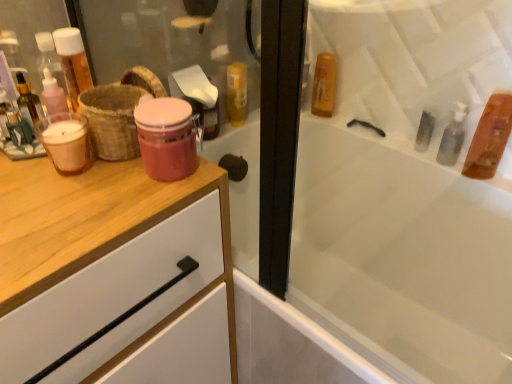
Question: Is translucent glass mouthwash at left, the first mouthwash positioned from the left, facing towards brown woven basket at left?

Choices:
 (A) no
 (B) yes

Answer: (A)

Question: Does translucent glass mouthwash at left, the 2th mouthwash when ordered from front to back, touch brown woven basket at left?

Choices:
 (A) no
 (B) yes

Answer: (B)

Question: From the image's perspective, is translucent glass mouthwash at left, which ranks as the 4th mouthwash in right-to-left order, beneath brown woven basket at left?

Choices:
 (A) yes
 (B) no

Answer: (A)

Question: From a real-world perspective, is translucent glass mouthwash at left, the third mouthwash when ordered from back to front, located beneath brown woven basket at left?

Choices:
 (A) no
 (B) yes

Answer: (B)

Question: Does translucent glass mouthwash at left, the 2th mouthwash when ordered from front to back, have a smaller size compared to brown woven basket at left?

Choices:
 (A) no
 (B) yes

Answer: (B)

Question: From a real-world perspective, is matte pink glass jar at center, acting as the 2th mouthwash starting from the left, above or below brown woven basket at left?

Choices:
 (A) above
 (B) below

Answer: (B)

Question: From the image's perspective, is matte pink glass jar at center, the 3th mouthwash from the right, positioned above or below brown woven basket at left?

Choices:
 (A) below
 (B) above

Answer: (A)

Question: In the image, is matte pink glass jar at center, the 1th mouthwash positioned from the front, on the left side or the right side of brown woven basket at left?

Choices:
 (A) left
 (B) right

Answer: (B)

Question: Is point (164, 137) closer or farther from the camera than point (104, 105)?

Choices:
 (A) closer
 (B) farther

Answer: (A)

Question: From the image's perspective, is matte pink glass jar at center, the 1th mouthwash positioned from the front, located above or below translucent amber liquid at upper right, the second mouthwash in the back-to-front sequence?

Choices:
 (A) below
 (B) above

Answer: (A)

Question: Based on their positions, is matte pink glass jar at center, the 3th mouthwash from the right, located to the left or right of translucent amber liquid at upper right, which is counted as the 1th mouthwash, starting from the right?

Choices:
 (A) right
 (B) left

Answer: (B)

Question: Would you say matte pink glass jar at center, the 3th mouthwash from the right, is inside or outside translucent amber liquid at upper right, which appears as the 4th mouthwash when viewed from the left?

Choices:
 (A) inside
 (B) outside

Answer: (B)

Question: Is matte pink glass jar at center, the 3th mouthwash from the right, in front of or behind translucent amber liquid at upper right, which is counted as the 1th mouthwash, starting from the right, in the image?

Choices:
 (A) front
 (B) behind

Answer: (A)

Question: Relative to matte pink glass jar at center, which is the 4th mouthwash from back to front, is translucent amber liquid at upper right, the second mouthwash in the back-to-front sequence, in front or behind?

Choices:
 (A) behind
 (B) front

Answer: (A)

Question: Is translucent amber liquid at upper right, which appears as the 4th mouthwash when viewed from the left, inside or outside of matte pink glass jar at center, the 1th mouthwash positioned from the front?

Choices:
 (A) outside
 (B) inside

Answer: (A)